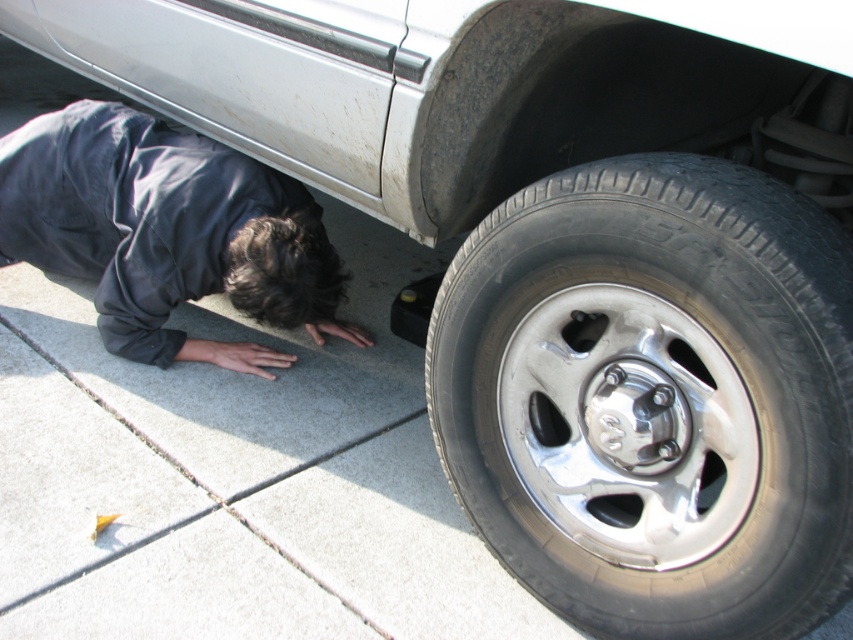
You are a mechanic working on a vehicle. You need to place a 36 inch long tool between the polished silver wheel at lower right and the dark gray fabric at lower left. Will the tool fit between them?

The distance between the polished silver wheel at lower right and the dark gray fabric at lower left is 35.03 inches, which is shorter than the tool. The tool will not fit between them.

You are a mechanic inspecting a vehicle. You notice the dark gray fabric at lower left and the silver metallic rim at lower right. Which object is closer to the left side of the vehicle?

The dark gray fabric at lower left is closer to the left side of the vehicle since it is positioned to the left of the silver metallic rim at lower right.